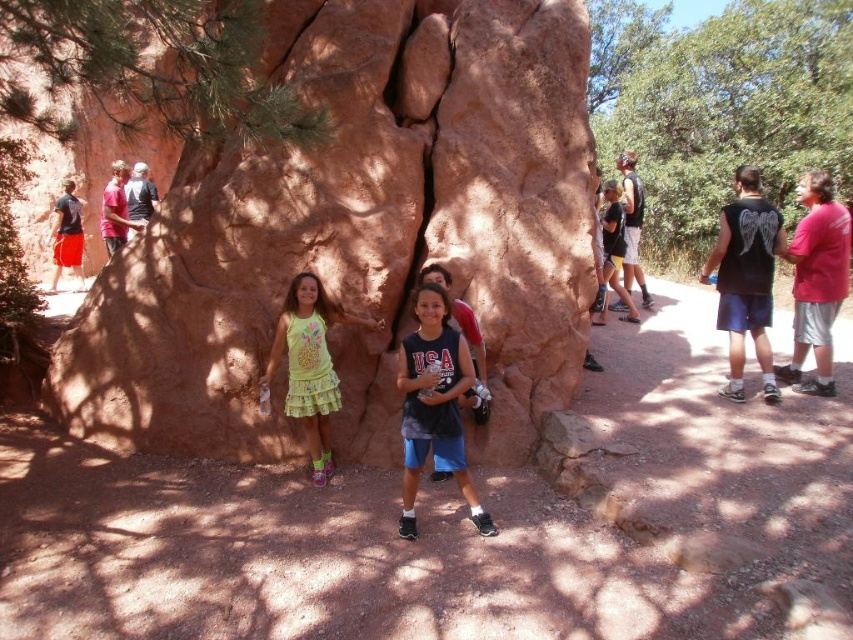
Question: From the image, what is the correct spatial relationship of black sleeveless shirt with wings at right in relation to matte black t-shirt at upper left?

Choices:
 (A) above
 (B) below

Answer: (B)

Question: Which object appears farthest from the camera in this image?

Choices:
 (A) dirt path at center
 (B) dark blue t-shirt at center
 (C) matte pink shirt at upper left
 (D) matte black shirt at left

Answer: (D)

Question: Which object appears closest to the camera in this image?

Choices:
 (A) pink cotton shirt at right
 (B) green pine tree at upper left
 (C) reddish-brown stone at center
 (D) yellow fabric dress at center

Answer: (B)

Question: Among these points, which one is nearest to the camera?

Choices:
 (A) (757, 593)
 (B) (637, 220)
 (C) (96, 282)

Answer: (A)

Question: Is the position of matte black shirt at left more distant than that of black tank top at center?

Choices:
 (A) yes
 (B) no

Answer: (A)

Question: Does green pine tree at upper left have a lesser width compared to matte black shirt at left?

Choices:
 (A) no
 (B) yes

Answer: (B)